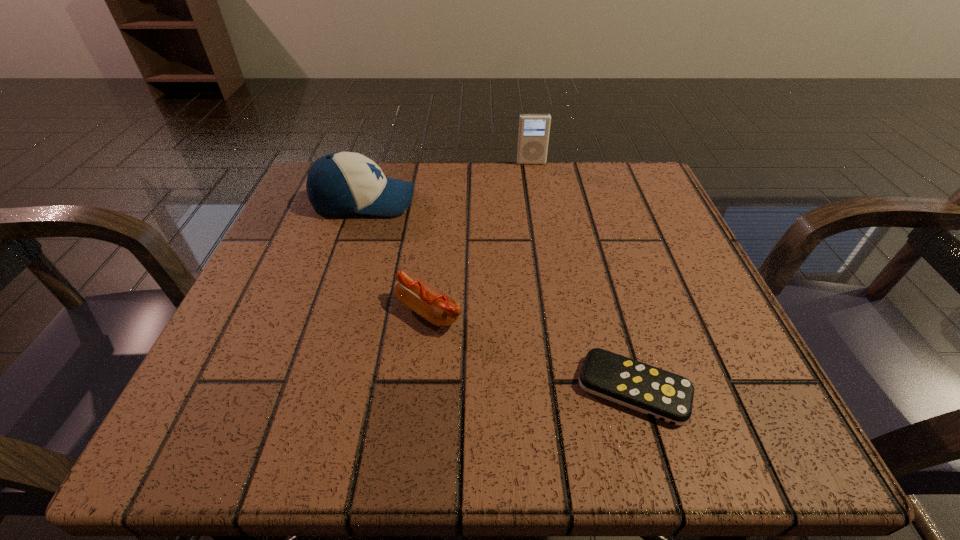
Where is `iPod`? The image size is (960, 540). iPod is located at coordinates (533, 136).

Where is `the second farthest object`? The height and width of the screenshot is (540, 960). the second farthest object is located at coordinates (340, 183).

I want to click on sausage, so click(438, 308).

Locate an element on the screen. This screenshot has width=960, height=540. the third farthest object is located at coordinates (438, 308).

I want to click on the shortest object, so click(661, 394).

Find the location of `the nearest object`. the nearest object is located at coordinates (661, 394).

You are a GUI agent. You are given a task and a screenshot of the screen. Output one action in this format:
    pyautogui.click(x=<x>, y=<y>)
    Task: Click on the free region located 0.080m on the front-facing side of the farthest object
    This screenshot has width=960, height=540.
    Given the screenshot: What is the action you would take?
    (x=535, y=184)

The image size is (960, 540). In order to click on vacant position located 0.300m on the front-facing side of the second farthest object in this screenshot , I will do `click(564, 202)`.

Where is `free space located on the right of the second shortest object`? The width and height of the screenshot is (960, 540). free space located on the right of the second shortest object is located at coordinates (694, 311).

This screenshot has width=960, height=540. What are the coordinates of `free space located on the back of the remote control` in the screenshot? It's located at (586, 220).